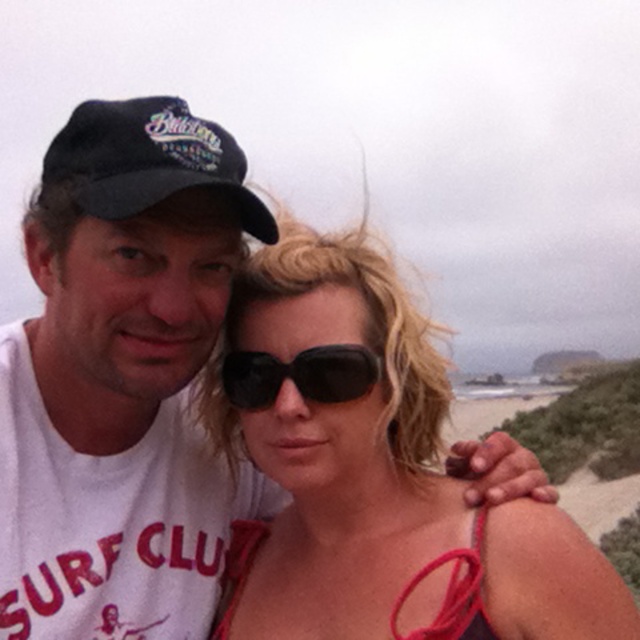
Does point (80, 205) come farther from viewer compared to point (333, 356)?

No, (80, 205) is in front of (333, 356).

Is black fabric baseball cap at upper left to the left of black matte sunglasses at center from the viewer's perspective?

Indeed, black fabric baseball cap at upper left is positioned on the left side of black matte sunglasses at center.

Looking at this image, who is more distant from viewer, (x=166, y=140) or (x=360, y=378)?

The point (x=360, y=378) is more distant.

At what (x,y) coordinates should I click in order to perform the action: click on black fabric baseball cap at upper left. Please return your answer as a coordinate pair (x, y). Image resolution: width=640 pixels, height=640 pixels. Looking at the image, I should click on (148, 161).

Can you confirm if matte black sunglasses at center is bigger than black fabric baseball cap at upper left?

No, matte black sunglasses at center is not bigger than black fabric baseball cap at upper left.

The image size is (640, 640). What do you see at coordinates (333, 436) in the screenshot?
I see `matte black sunglasses at center` at bounding box center [333, 436].

Where is `matte black sunglasses at center`? matte black sunglasses at center is located at coordinates (333, 436).

Does matte black sunglasses at center appear on the right side of black matte sunglasses at center?

Correct, you'll find matte black sunglasses at center to the right of black matte sunglasses at center.

Which is below, matte black sunglasses at center or black matte sunglasses at center?

matte black sunglasses at center is below.

Does point (243, 589) lie in front of point (275, 385)?

That is False.

Where is `matte black sunglasses at center`? The height and width of the screenshot is (640, 640). matte black sunglasses at center is located at coordinates (333, 436).